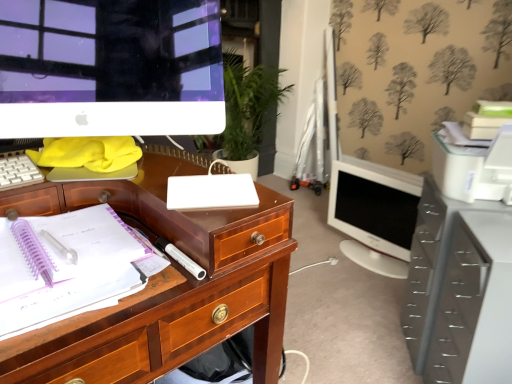
Where is `metallic gray file cabinet at lower right`? The image size is (512, 384). metallic gray file cabinet at lower right is located at coordinates (430, 265).

Image resolution: width=512 pixels, height=384 pixels. In order to click on translucent plastic pen at left, the second office supplies from the right in this screenshot , I will do `click(78, 267)`.

The image size is (512, 384). Identify the location of white glossy computer monitor at upper left, the 1th computer monitor positioned from the left. (110, 68).

Measure the distance between white plastic keyboard at left and camera.

The depth of white plastic keyboard at left is 30.98 inches.

The height and width of the screenshot is (384, 512). What are the coordinates of `metallic gray file cabinet at lower right` in the screenshot? It's located at [430, 265].

In order to click on computer keyboard behind the white glossy computer monitor at upper left, the 1th computer monitor positioned from the left in this screenshot , I will do `click(18, 171)`.

Which object is positioned more to the right, white plastic keyboard at left or white glossy computer monitor at upper left, the 2th computer monitor when ordered from back to front?

white glossy computer monitor at upper left, the 2th computer monitor when ordered from back to front.

From a real-world perspective, which is physically below, white plastic keyboard at left or white glossy computer monitor at upper left, which ranks as the second computer monitor in right-to-left order?

white plastic keyboard at left, from a real-world perspective.

Is white plastic keyboard at left turned away from white glossy computer monitor at upper left, the 1th computer monitor positioned from the left?

No, white plastic keyboard at left's orientation is not away from white glossy computer monitor at upper left, the 1th computer monitor positioned from the left.

In terms of width, does white glossy computer monitor at upper left, the 2th computer monitor when ordered from back to front, look wider or thinner when compared to translucent plastic pen at left, which ranks as the 2th office supplies in top-to-bottom order?

In the image, white glossy computer monitor at upper left, the 2th computer monitor when ordered from back to front, appears to be more narrow than translucent plastic pen at left, which ranks as the 2th office supplies in top-to-bottom order.

Is the position of white glossy computer monitor at upper left, the 2th computer monitor when ordered from back to front, more distant than that of translucent plastic pen at left, marked as the 1th office supplies in a left-to-right arrangement?

Yes.

Between white glossy computer monitor at upper left, the 1th computer monitor positioned from the left, and translucent plastic pen at left, the second office supplies from the right, which one appears on the left side from the viewer's perspective?

From the viewer's perspective, translucent plastic pen at left, the second office supplies from the right, appears more on the left side.

In terms of size, does white glossy computer monitor at upper left, the 2th computer monitor when ordered from back to front, appear bigger or smaller than translucent plastic pen at left, the first office supplies in the bottom-to-top sequence?

Clearly, white glossy computer monitor at upper left, the 2th computer monitor when ordered from back to front, is larger in size than translucent plastic pen at left, the first office supplies in the bottom-to-top sequence.

Is white glossy monitor at center right, the second computer monitor in the front-to-back sequence, located within translucent plastic pen at left, marked as the 1th office supplies in a left-to-right arrangement?

No, translucent plastic pen at left, marked as the 1th office supplies in a left-to-right arrangement, does not contain white glossy monitor at center right, the second computer monitor in the front-to-back sequence.

Is translucent plastic pen at left, marked as the 1th office supplies in a left-to-right arrangement, placed right next to white glossy monitor at center right, which is counted as the 2th computer monitor, starting from the left?

No, translucent plastic pen at left, marked as the 1th office supplies in a left-to-right arrangement, is not with white glossy monitor at center right, which is counted as the 2th computer monitor, starting from the left.

Consider the image. Does translucent plastic pen at left, which ranks as the 2th office supplies in top-to-bottom order, turn towards white glossy monitor at center right, the 1th computer monitor from the back?

No, translucent plastic pen at left, which ranks as the 2th office supplies in top-to-bottom order, is not facing towards white glossy monitor at center right, the 1th computer monitor from the back.

From a real-world perspective, is white glossy monitor at center right, which is counted as the 2th computer monitor, starting from the left, positioned under white matte notebook at center, the 2th office supplies positioned from the left, based on gravity?

Indeed, from a real-world perspective, white glossy monitor at center right, which is counted as the 2th computer monitor, starting from the left, is positioned beneath white matte notebook at center, the 2th office supplies positioned from the left.

Are white glossy monitor at center right, the second computer monitor in the front-to-back sequence, and white matte notebook at center, the 2th office supplies positioned from the left, making contact?

white glossy monitor at center right, the second computer monitor in the front-to-back sequence, and white matte notebook at center, the 2th office supplies positioned from the left, are clearly separated.

Does white glossy monitor at center right, the 1th computer monitor from the back, have a greater height compared to white matte notebook at center, the 2th office supplies positioned from the left?

Yes, white glossy monitor at center right, the 1th computer monitor from the back, is taller than white matte notebook at center, the 2th office supplies positioned from the left.

Which is in front, point (336, 168) or point (238, 180)?

The point (238, 180) is more forward.

Which is closer to the camera, (189, 189) or (372, 180)?

Point (189, 189) is closer to the camera than point (372, 180).

From the image's perspective, between white matte notebook at center, the 2th office supplies positioned from the left, and white glossy monitor at center right, which is the 1th computer monitor from right to left, who is located below?

white glossy monitor at center right, which is the 1th computer monitor from right to left, is shown below in the image.

From a real-world perspective, between white matte notebook at center, the first office supplies when ordered from right to left, and white glossy monitor at center right, the second computer monitor in the front-to-back sequence, who is vertically lower?

white glossy monitor at center right, the second computer monitor in the front-to-back sequence, is physically lower.

Is white matte notebook at center, the second office supplies when ordered from bottom to top, directly adjacent to white glossy monitor at center right, the second computer monitor in the front-to-back sequence?

No, white matte notebook at center, the second office supplies when ordered from bottom to top, is not beside white glossy monitor at center right, the second computer monitor in the front-to-back sequence.

From the image's perspective, is white glossy monitor at center right, the 1th computer monitor from the back, over translucent plastic pen at left, which ranks as the 2th office supplies in top-to-bottom order?

Correct, white glossy monitor at center right, the 1th computer monitor from the back, appears higher than translucent plastic pen at left, which ranks as the 2th office supplies in top-to-bottom order, in the image.

From a real-world perspective, is white glossy monitor at center right, which is counted as the 2th computer monitor, starting from the left, physically above translucent plastic pen at left, which ranks as the 2th office supplies in top-to-bottom order?

Actually, white glossy monitor at center right, which is counted as the 2th computer monitor, starting from the left, is physically below translucent plastic pen at left, which ranks as the 2th office supplies in top-to-bottom order, in the real world.

Looking at the image, does white glossy monitor at center right, the 1th computer monitor from the back, seem bigger or smaller compared to translucent plastic pen at left, marked as the 1th office supplies in a left-to-right arrangement?

white glossy monitor at center right, the 1th computer monitor from the back, is bigger than translucent plastic pen at left, marked as the 1th office supplies in a left-to-right arrangement.

Is point (382, 263) positioned in front of point (80, 283)?

That is False.

Does point (58, 237) appear closer or farther from the camera than point (204, 15)?

Point (58, 237) is positioned closer to the camera compared to point (204, 15).

Which of these two, translucent plastic pen at left, the first office supplies in the bottom-to-top sequence, or white glossy computer monitor at upper left, the 2th computer monitor when ordered from back to front, is bigger?

Bigger between the two is white glossy computer monitor at upper left, the 2th computer monitor when ordered from back to front.

Considering the relative positions of translucent plastic pen at left, the second office supplies from the right, and white glossy computer monitor at upper left, the 2th computer monitor when ordered from back to front, in the image provided, is translucent plastic pen at left, the second office supplies from the right, behind white glossy computer monitor at upper left, the 2th computer monitor when ordered from back to front,?

No, translucent plastic pen at left, the second office supplies from the right, is closer to the viewer.

Could white glossy computer monitor at upper left, the 1th computer monitor positioned from the left, be considered to be inside translucent plastic pen at left, the first office supplies in the bottom-to-top sequence?

No, translucent plastic pen at left, the first office supplies in the bottom-to-top sequence, does not contain white glossy computer monitor at upper left, the 1th computer monitor positioned from the left.

You are a GUI agent. You are given a task and a screenshot of the screen. Output one action in this format:
    pyautogui.click(x=<x>, y=<y>)
    Task: Click on the computer keyboard behind the white glossy computer monitor at upper left, the 1th computer monitor positioned from the left
    This screenshot has height=384, width=512.
    Given the screenshot: What is the action you would take?
    pyautogui.click(x=18, y=171)

Find the location of a particular element. office supplies that is in front of the white glossy computer monitor at upper left, the 1th computer monitor positioned from the front is located at coordinates (78, 267).

Estimate the real-world distances between objects in this image. Which object is further from translucent plastic pen at left, marked as the 1th office supplies in a left-to-right arrangement, white glossy computer monitor at upper left, which ranks as the second computer monitor in right-to-left order, or white glossy monitor at center right, which is the 1th computer monitor from right to left?

white glossy monitor at center right, which is the 1th computer monitor from right to left.

Which object lies further to the anchor point translucent plastic pen at left, the second office supplies from the right, white plastic keyboard at left or white glossy monitor at center right, the second computer monitor in the front-to-back sequence?

white glossy monitor at center right, the second computer monitor in the front-to-back sequence, lies further to translucent plastic pen at left, the second office supplies from the right, than the other object.

From the image, which object appears to be farther from white plastic keyboard at left, white matte notebook at center, the 2th office supplies positioned from the left, or white glossy monitor at center right, the second computer monitor in the front-to-back sequence?

Among the two, white glossy monitor at center right, the second computer monitor in the front-to-back sequence, is located further to white plastic keyboard at left.

Considering their positions, is translucent plastic pen at left, the second office supplies from the right, positioned closer to white matte notebook at center, the second office supplies when ordered from bottom to top, than white plastic keyboard at left?

translucent plastic pen at left, the second office supplies from the right, lies closer to white matte notebook at center, the second office supplies when ordered from bottom to top, than the other object.

From the image, which object appears to be farther from white matte notebook at center, the 2th office supplies positioned from the left, white plastic keyboard at left or metallic gray file cabinet at lower right?

Based on the image, metallic gray file cabinet at lower right appears to be further to white matte notebook at center, the 2th office supplies positioned from the left.

Which object lies nearer to the anchor point white plastic keyboard at left, white glossy monitor at center right, the 1th computer monitor from the back, or white glossy computer monitor at upper left, the 1th computer monitor positioned from the left?

white glossy computer monitor at upper left, the 1th computer monitor positioned from the left, is positioned closer to the anchor white plastic keyboard at left.

From the image, which object appears to be farther from white plastic keyboard at left, white glossy computer monitor at upper left, the 2th computer monitor when ordered from back to front, or white glossy monitor at center right, the second computer monitor in the front-to-back sequence?

white glossy monitor at center right, the second computer monitor in the front-to-back sequence.

Based on their spatial positions, is white glossy monitor at center right, the 1th computer monitor from the back, or white plastic keyboard at left closer to translucent plastic pen at left, the second office supplies from the right?

white plastic keyboard at left.

Where is `computer monitor between translucent plastic pen at left, marked as the 1th office supplies in a left-to-right arrangement, and white glossy monitor at center right, which is counted as the 2th computer monitor, starting from the left, in the front-back direction`? The image size is (512, 384). computer monitor between translucent plastic pen at left, marked as the 1th office supplies in a left-to-right arrangement, and white glossy monitor at center right, which is counted as the 2th computer monitor, starting from the left, in the front-back direction is located at coordinates (110, 68).

You are a GUI agent. You are given a task and a screenshot of the screen. Output one action in this format:
    pyautogui.click(x=<x>, y=<y>)
    Task: Click on the office supplies situated between translucent plastic pen at left, the first office supplies in the bottom-to-top sequence, and metallic gray file cabinet at lower right from left to right
    
    Given the screenshot: What is the action you would take?
    pyautogui.click(x=211, y=191)

Locate an element on the screen. office supplies between white glossy computer monitor at upper left, which ranks as the second computer monitor in right-to-left order, and translucent plastic pen at left, the first office supplies in the bottom-to-top sequence, in the vertical direction is located at coordinates (211, 191).

The width and height of the screenshot is (512, 384). In order to click on office supplies between white glossy computer monitor at upper left, the 1th computer monitor positioned from the front, and metallic gray file cabinet at lower right from left to right in this screenshot , I will do `click(211, 191)`.